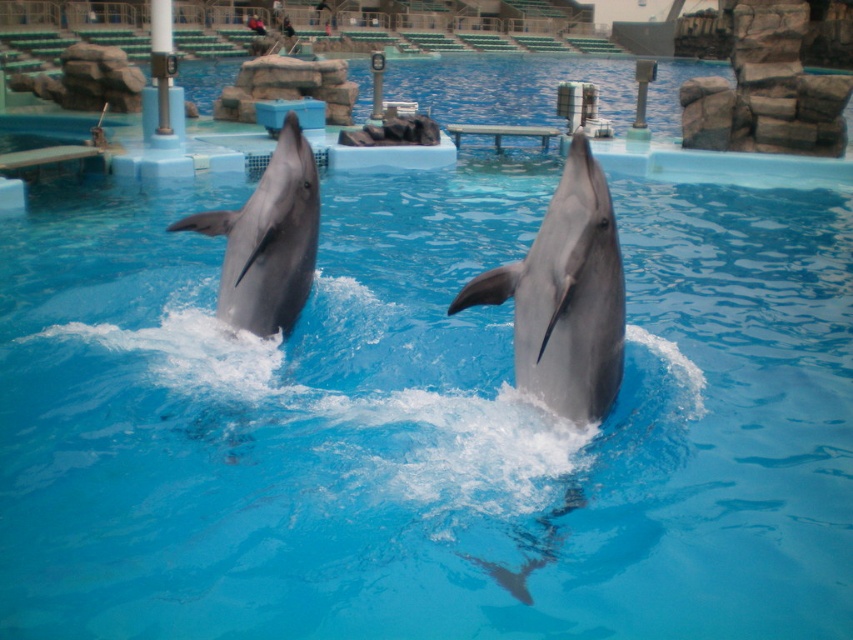
You are standing at the edge of the dolphin show pool and want to locate two specific points marked in the image. The first point is at coordinates point (517, 298) and the second is at point (193, 214). Which of these two points is nearer to your current position?

Point (517, 298) is closer to the viewer than point (193, 214), so the first point is nearer to your current position.